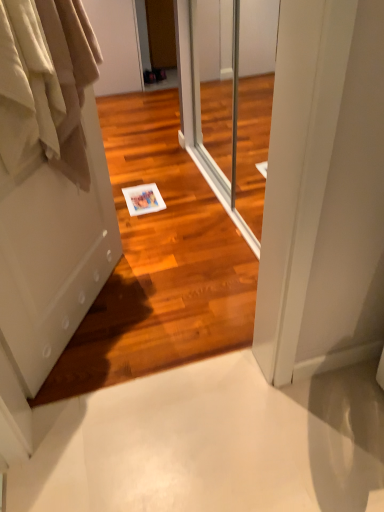
The height and width of the screenshot is (512, 384). I want to click on vacant space behind white matte door at left, so click(150, 245).